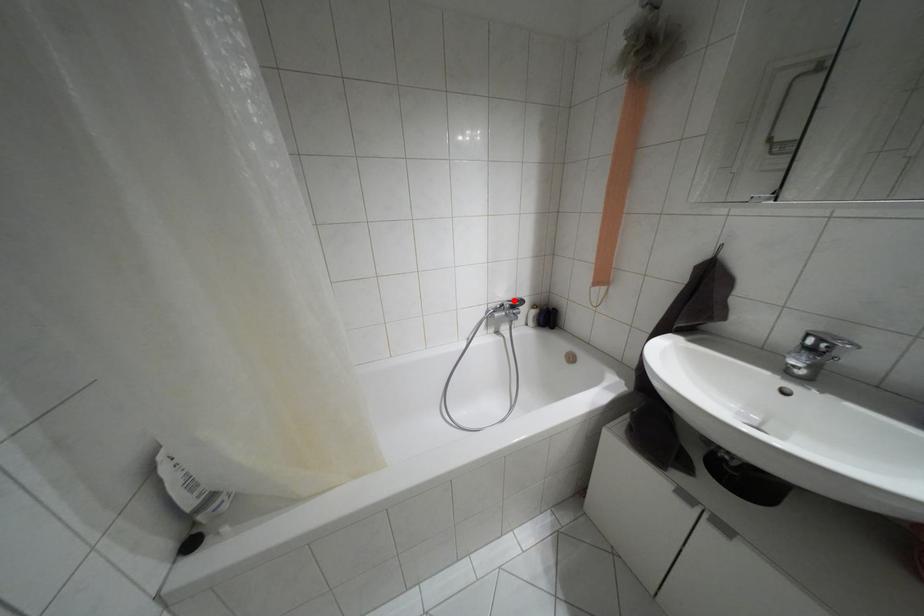
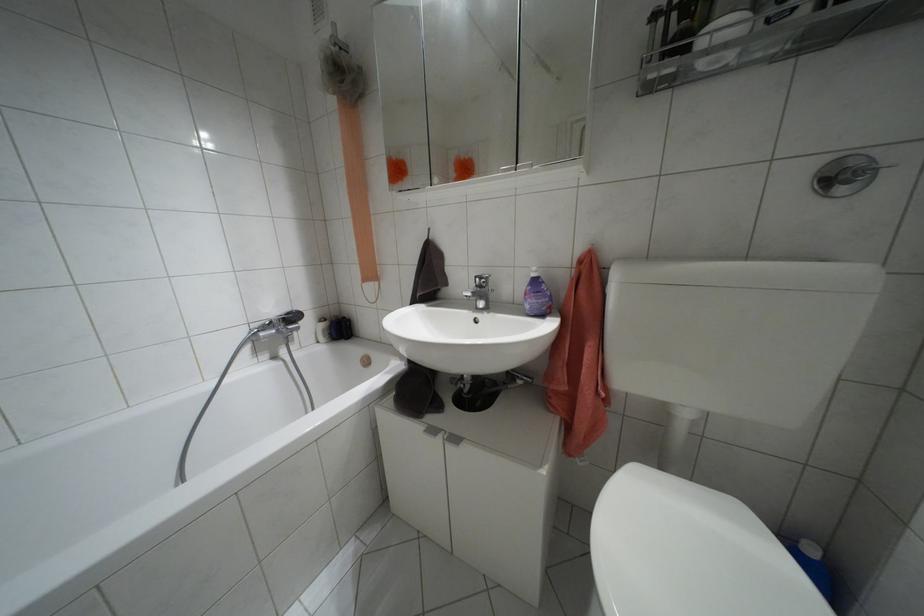
Where in the second image is the point corresponding to the highlighted location from the first image?

(286, 313)